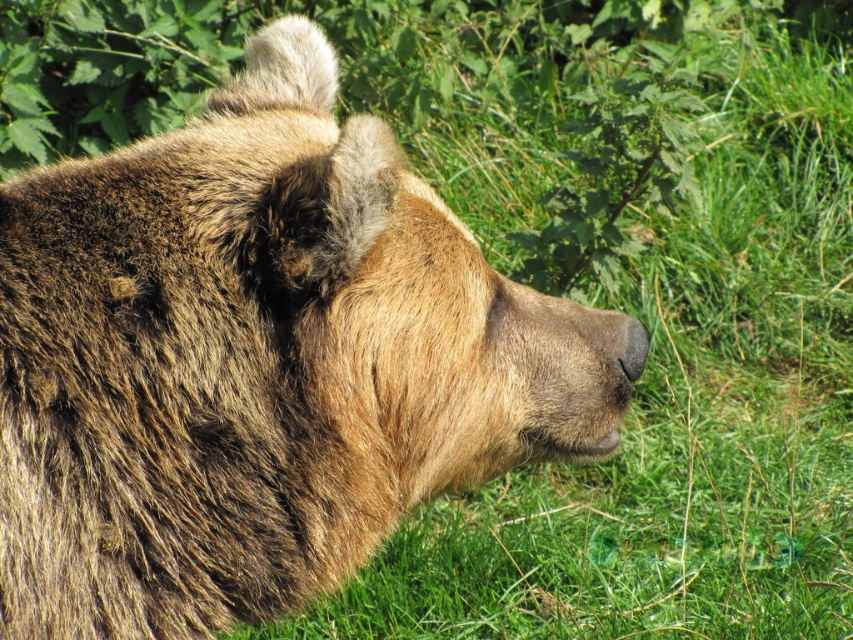
Which is in front, point (560, 444) or point (645, 157)?

Positioned in front is point (560, 444).

Is fuzzy brown bear at center shorter than green leafy plant at upper center?

No.

The height and width of the screenshot is (640, 853). Identify the location of fuzzy brown bear at center. (257, 362).

Is green leafy plant at upper center thinner than black fur nose at center?

No, green leafy plant at upper center is not thinner than black fur nose at center.

Is green leafy plant at upper center below black fur nose at center?

Incorrect, green leafy plant at upper center is not positioned below black fur nose at center.

What do you see at coordinates (614, 172) in the screenshot? I see `green leafy plant at upper center` at bounding box center [614, 172].

Where is `green leafy plant at upper center`? green leafy plant at upper center is located at coordinates (614, 172).

Which is above, fuzzy brown bear at center or black fur nose at center?

fuzzy brown bear at center

Who is more forward, (268, 486) or (625, 353)?

Positioned in front is point (268, 486).

You are a GUI agent. You are given a task and a screenshot of the screen. Output one action in this format:
    pyautogui.click(x=<x>, y=<y>)
    Task: Click on the fuzzy brown bear at center
    The height and width of the screenshot is (640, 853).
    Given the screenshot: What is the action you would take?
    pyautogui.click(x=257, y=362)

Locate an element on the screen. fuzzy brown bear at center is located at coordinates (257, 362).